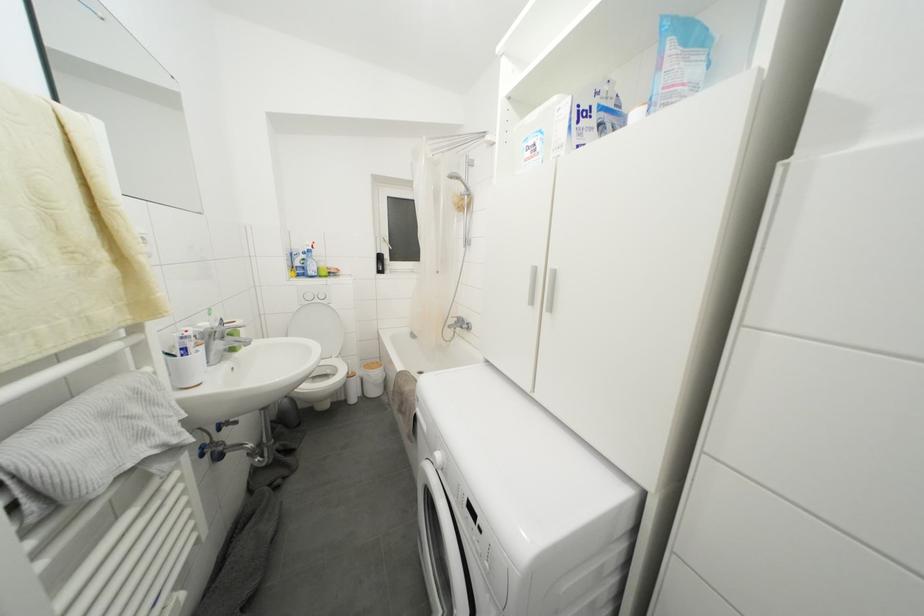
Describe the element at coordinates (310, 261) in the screenshot. I see `the blue spray bottle` at that location.